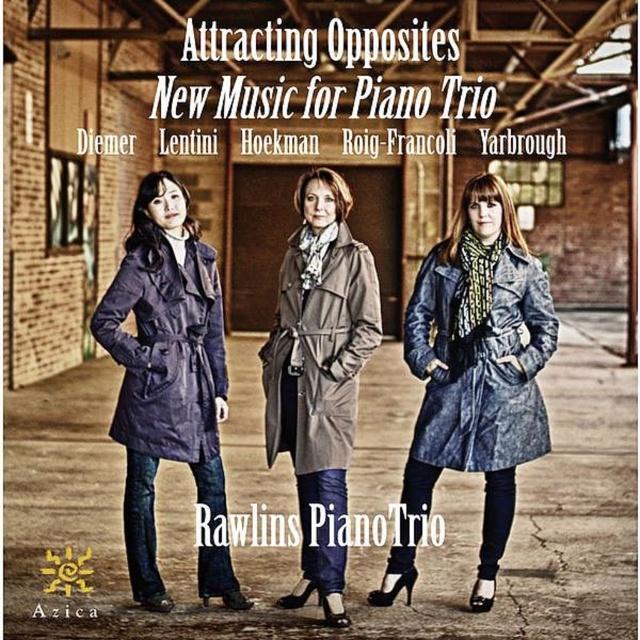
Question: Considering the relative positions of denim jacket at lower right and light gray textured coat at center in the image provided, where is denim jacket at lower right located with respect to light gray textured coat at center?

Choices:
 (A) above
 (B) below

Answer: (B)

Question: Which object is closer to the camera taking this photo?

Choices:
 (A) denim trench coat at left
 (B) navy blue leather coat at left
 (C) light gray textured coat at center
 (D) denim coat at center

Answer: (B)

Question: Which object appears closest to the camera in this image?

Choices:
 (A) denim coat at center
 (B) denim trench coat at left
 (C) navy blue leather coat at left

Answer: (C)

Question: Is denim coat at center further to camera compared to navy blue leather coat at left?

Choices:
 (A) no
 (B) yes

Answer: (B)

Question: In this image, where is denim trench coat at left located relative to light gray textured coat at center?

Choices:
 (A) above
 (B) below

Answer: (B)

Question: Which point is closer to the camera?

Choices:
 (A) 349,308
 (B) 172,417

Answer: (B)